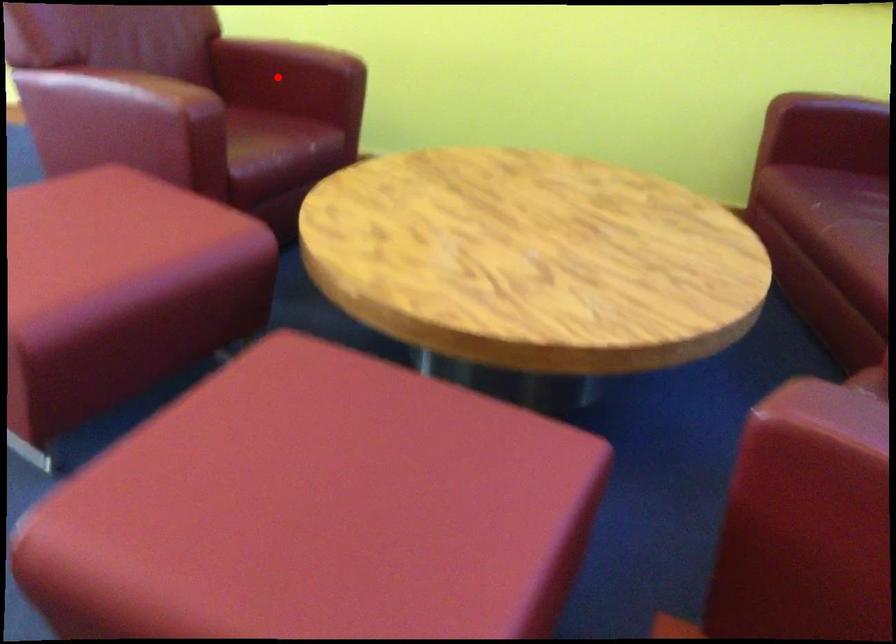
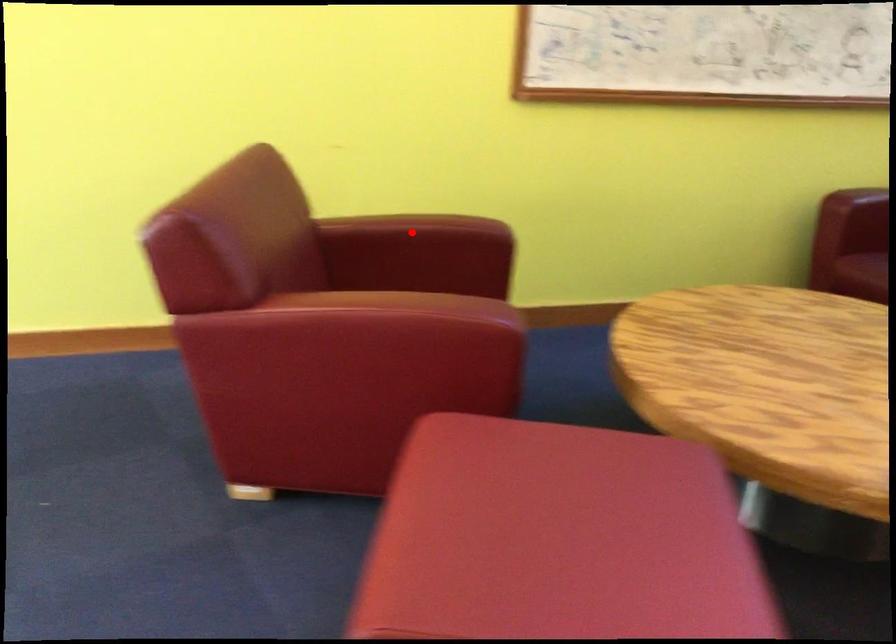
I am providing you with two images of the same scene from different viewpoints. A red point is marked on the first image and another point is marked on the second image. Are the points marked in image1 and image2 representing the same 3D position?

No